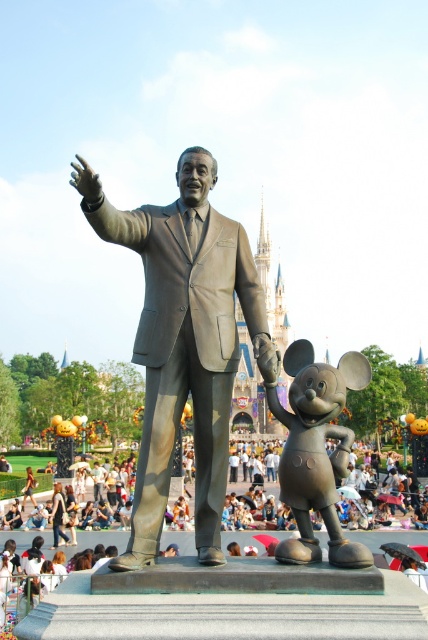
At what (x,y) coordinates should I click in order to perform the action: click on matte bronze statue at center. Please return your answer as a coordinate pair (x, y). Looking at the image, I should click on (231, 604).

Based on the photo, is matte bronze statue at center to the left of bronze mickey mouse at center from the viewer's perspective?

Correct, you'll find matte bronze statue at center to the left of bronze mickey mouse at center.

Describe the element at coordinates (231, 604) in the screenshot. I see `matte bronze statue at center` at that location.

I want to click on matte bronze statue at center, so click(231, 604).

Who is taller, bronze statue at center or matte bronze statue at center?

bronze statue at center is taller.

Between bronze statue at center and matte bronze statue at center, which one appears on the right side from the viewer's perspective?

matte bronze statue at center

You are a GUI agent. You are given a task and a screenshot of the screen. Output one action in this format:
    pyautogui.click(x=<x>, y=<y>)
    Task: Click on the bronze statue at center
    This screenshot has height=640, width=428.
    Given the screenshot: What is the action you would take?
    pyautogui.click(x=184, y=340)

Which is behind, point (94, 224) or point (288, 461)?

Positioned behind is point (288, 461).

Is bronze statue at center shorter than bronze mickey mouse at center?

Incorrect, bronze statue at center's height does not fall short of bronze mickey mouse at center's.

The image size is (428, 640). Identify the location of bronze statue at center. (184, 340).